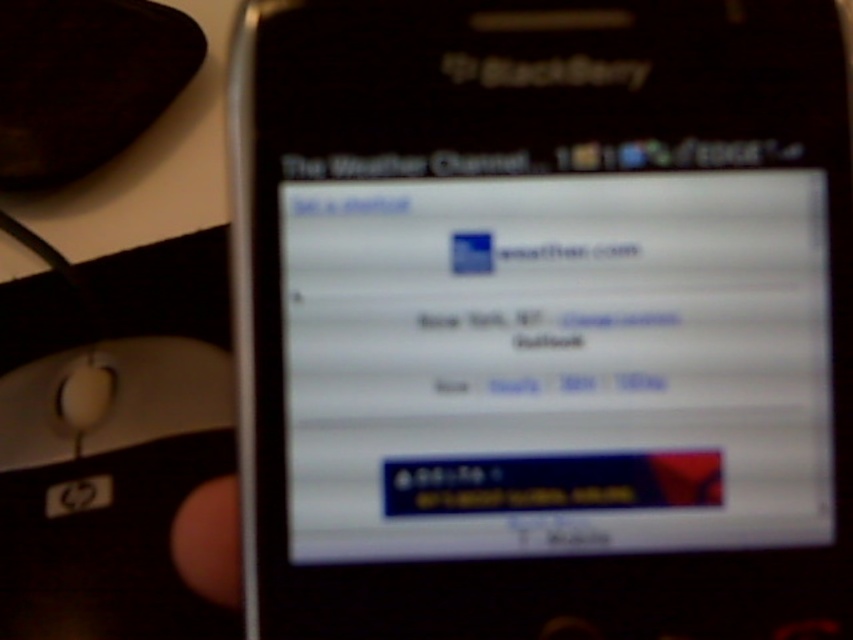
Question: Which of the following is the farthest from the observer?

Choices:
 (A) (421, 83)
 (B) (164, 371)

Answer: (B)

Question: Does black matte smartphone at center have a smaller size compared to white plastic mouse at lower left?

Choices:
 (A) no
 (B) yes

Answer: (B)

Question: Which point is closer to the camera?

Choices:
 (A) (373, 531)
 (B) (16, 456)

Answer: (A)

Question: Is black matte smartphone at center closer to camera compared to white plastic mouse at lower left?

Choices:
 (A) no
 (B) yes

Answer: (B)

Question: Does black matte smartphone at center have a smaller size compared to white plastic mouse at lower left?

Choices:
 (A) no
 (B) yes

Answer: (B)

Question: Among these objects, which one is nearest to the camera?

Choices:
 (A) black matte smartphone at center
 (B) white plastic mouse at lower left

Answer: (A)